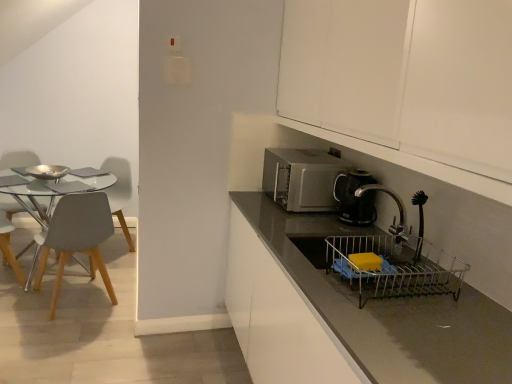
Identify the location of free point in front of light gray plastic chair at left, the first chair positioned from the right. The width and height of the screenshot is (512, 384). (57, 336).